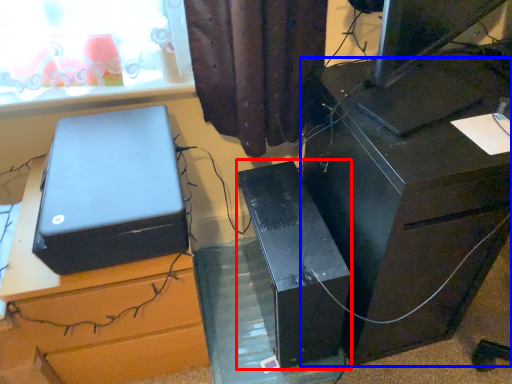
Question: Which object is further to the camera taking this photo, computer tower (highlighted by a red box) or furniture (highlighted by a blue box)?

Choices:
 (A) computer tower
 (B) furniture

Answer: (A)